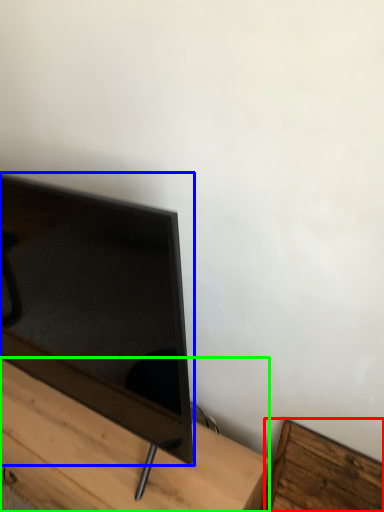
Question: Based on their relative distances, which object is nearer to furniture (highlighted by a red box)? Choose from television (highlighted by a blue box) and furniture (highlighted by a green box).

Choices:
 (A) television
 (B) furniture

Answer: (B)